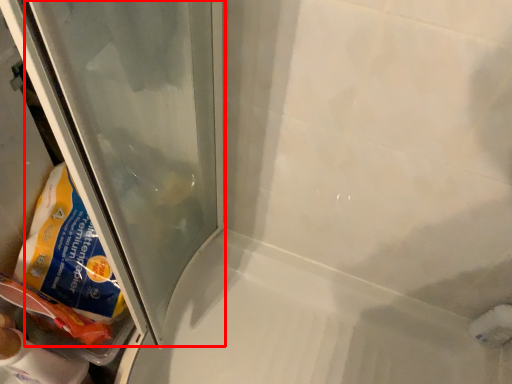
Question: Considering the relative positions of glass door (annotated by the red box) and bath in the image provided, where is glass door (annotated by the red box) located with respect to the staircase?

Choices:
 (A) left
 (B) right

Answer: (A)